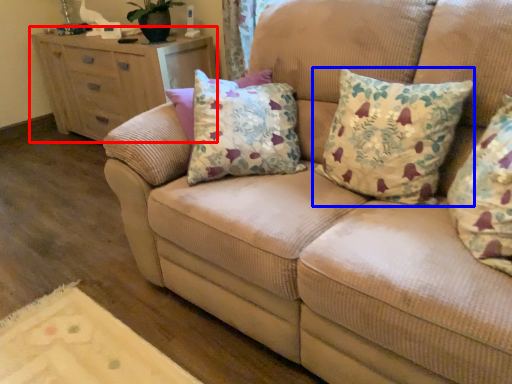
Question: Which point is closer to the camera, chest of drawers (highlighted by a red box) or pillow (highlighted by a blue box)?

Choices:
 (A) chest of drawers
 (B) pillow

Answer: (B)